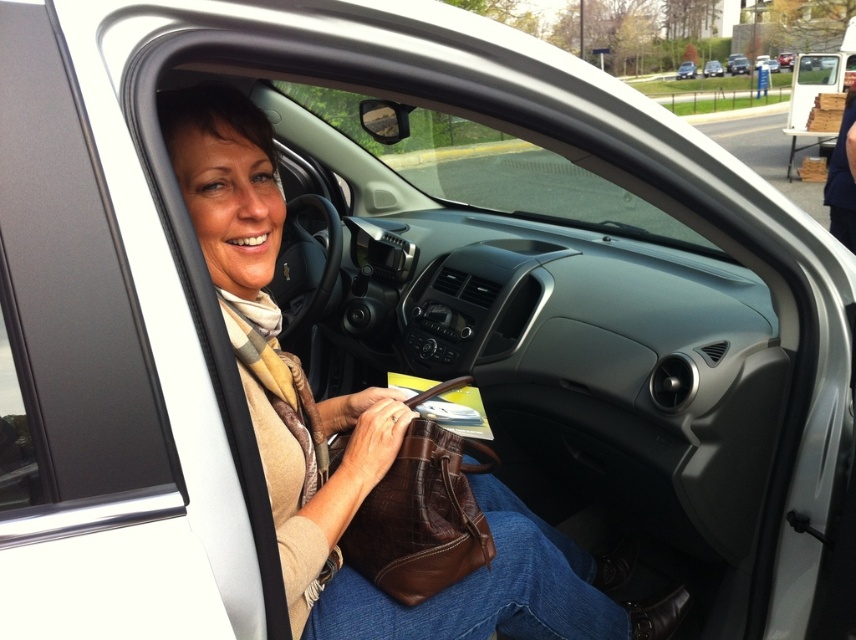
Consider the image. Between brown leather purse at center and silver metallic sedan at upper center, which one appears on the right side from the viewer's perspective?

From the viewer's perspective, silver metallic sedan at upper center appears more on the right side.

Can you confirm if brown leather purse at center is bigger than silver metallic sedan at upper center?

Correct, brown leather purse at center is larger in size than silver metallic sedan at upper center.

Which is in front, point (262, 440) or point (714, 72)?

Point (262, 440) is in front.

This screenshot has height=640, width=856. Identify the location of brown leather purse at center. (360, 433).

Does silver metallic sedan at upper center appear on the right side of white matte car at center?

Indeed, silver metallic sedan at upper center is positioned on the right side of white matte car at center.

This screenshot has width=856, height=640. Describe the element at coordinates (728, 67) in the screenshot. I see `silver metallic sedan at upper center` at that location.

Is point (735, 65) positioned behind point (687, 67)?

Yes.

Find the location of a particular element. The image size is (856, 640). silver metallic sedan at upper center is located at coordinates (728, 67).

Does white matte car at center have a greater width compared to metallic silver sedan at center?

No.

Where is `white matte car at center`? white matte car at center is located at coordinates (687, 70).

Does point (681, 68) lie behind point (716, 72)?

No, (681, 68) is in front of (716, 72).

Where is `white matte car at center`? The height and width of the screenshot is (640, 856). white matte car at center is located at coordinates pyautogui.click(x=687, y=70).